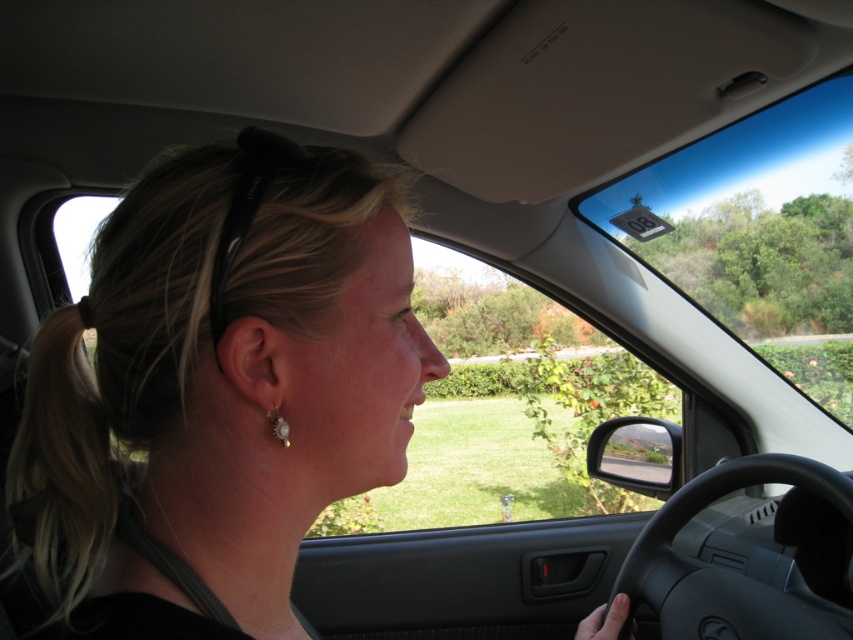
Who is lower down, blonde hair at left or black rubber steering wheel at lower right?

black rubber steering wheel at lower right is lower down.

This screenshot has width=853, height=640. Identify the location of blonde hair at left. (62, 460).

Between point (103, 291) and point (665, 522), which one is positioned behind?

Positioned behind is point (665, 522).

Who is more forward, (409, 436) or (695, 502)?

Point (409, 436) is more forward.

Locate an element on the screen. blonde hair at center is located at coordinates (218, 388).

This screenshot has height=640, width=853. In order to click on blonde hair at center in this screenshot , I will do `click(218, 388)`.

Which of these two, black rubber steering wheel at lower right or pearl earrings at ear, stands taller?

black rubber steering wheel at lower right

Is black rubber steering wheel at lower right in front of pearl earrings at ear?

No, black rubber steering wheel at lower right is further to the viewer.

Is point (750, 616) behind point (287, 445)?

Yes, it is.

You are a GUI agent. You are given a task and a screenshot of the screen. Output one action in this format:
    pyautogui.click(x=<x>, y=<y>)
    Task: Click on the black rubber steering wheel at lower right
    Image resolution: width=853 pixels, height=640 pixels.
    Given the screenshot: What is the action you would take?
    pyautogui.click(x=723, y=564)